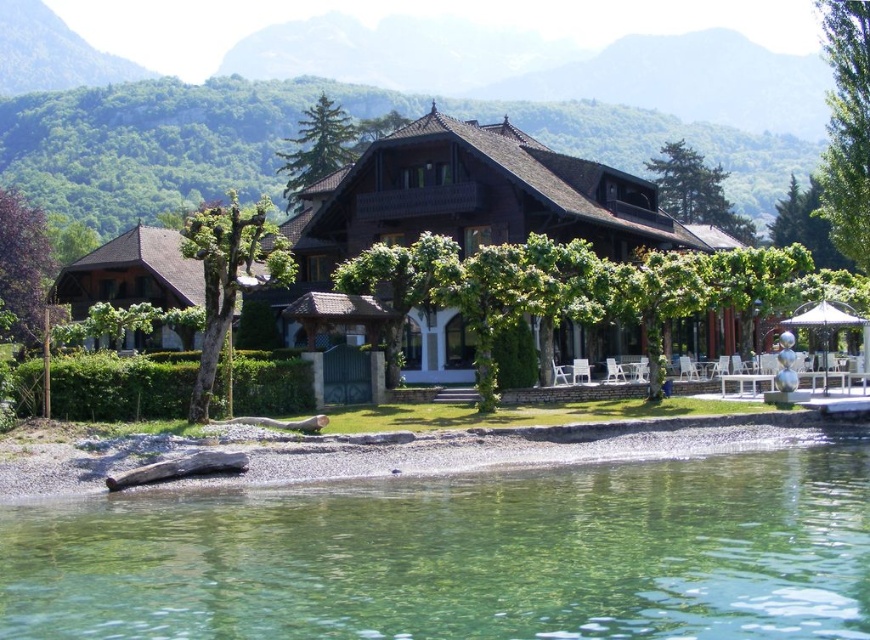
Question: Which point is closer to the camera?

Choices:
 (A) clear water at lower center
 (B) smooth gravel shore at lower left
 (C) brown wooden gazebo at center

Answer: (A)

Question: Which object is the closest to the brown wooden gazebo at center?

Choices:
 (A) clear water at lower center
 (B) smooth gravel shore at lower left

Answer: (B)

Question: In this image, where is clear water at lower center located relative to smooth gravel shore at lower left?

Choices:
 (A) left
 (B) right

Answer: (B)

Question: Among these points, which one is nearest to the camera?

Choices:
 (A) (547, 184)
 (B) (547, 461)

Answer: (B)

Question: Is clear water at lower center above brown wooden gazebo at center?

Choices:
 (A) yes
 (B) no

Answer: (B)

Question: Is clear water at lower center in front of brown wooden gazebo at center?

Choices:
 (A) no
 (B) yes

Answer: (B)